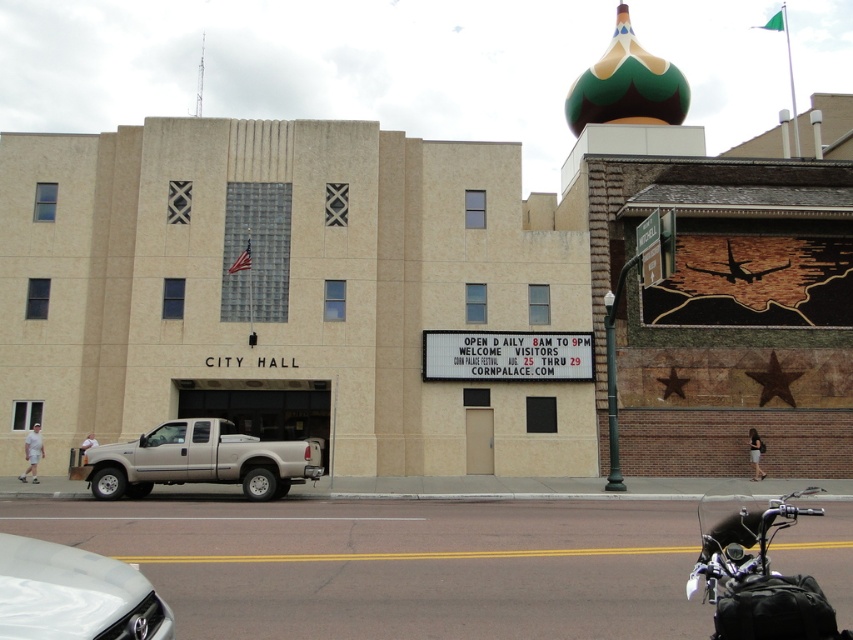
You are a visitor standing at the entrance of the city hall building. You see the black textured motorcycle at lower right. If you want to take a photo of the digital signboard to the right of the building and the motorcycle in the same frame, where should you position yourself relative to the motorcycle?

To capture both the digital signboard to the right of the building and the black textured motorcycle at lower right in the same frame, you should position yourself to the left of the motorcycle. This allows the motorcycle to be on the right side of the photo while the signboard remains visible on the left side of the frame.